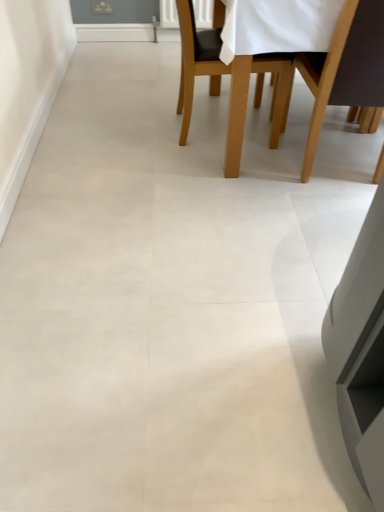
Locate an element on the screen. The width and height of the screenshot is (384, 512). vacant region in front of brown wood chair at upper right, the first chair positioned from the right is located at coordinates (324, 214).